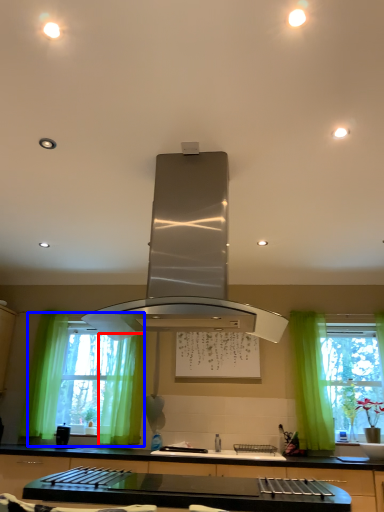
Question: Which object is closer to the camera taking this photo, curtain (highlighted by a red box) or window (highlighted by a blue box)?

Choices:
 (A) curtain
 (B) window

Answer: (A)